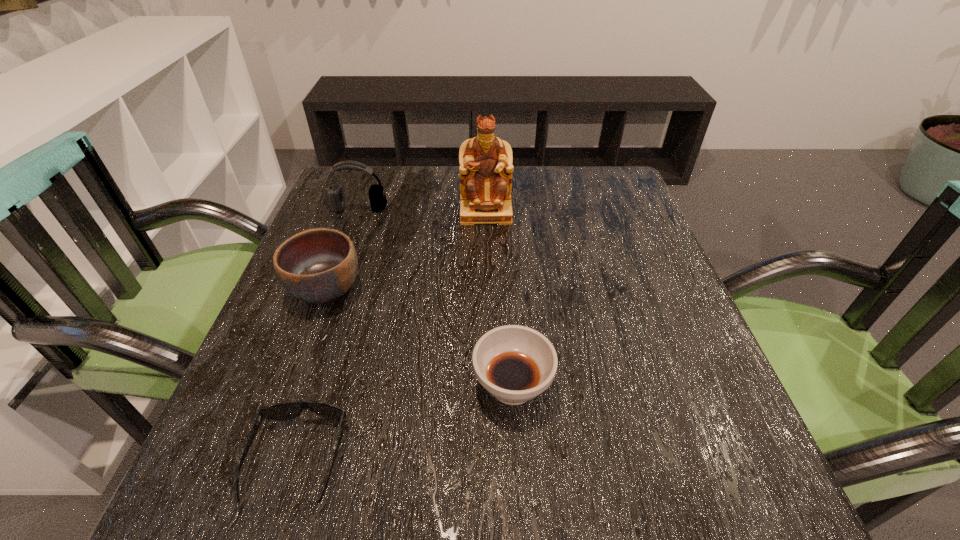
At what (x,y) coordinates should I click in order to perform the action: click on figurine at the far edge. Please return your answer as a coordinate pair (x, y). This screenshot has height=540, width=960. Looking at the image, I should click on (485, 161).

Locate an element on the screen. headset located in the far edge section of the desktop is located at coordinates pos(335,200).

Find the location of a particular element. object that is at the near edge is located at coordinates (281, 411).

You are a GUI agent. You are given a task and a screenshot of the screen. Output one action in this format:
    pyautogui.click(x=<x>, y=<y>)
    Task: Click on the headset that is at the left edge
    
    Given the screenshot: What is the action you would take?
    pyautogui.click(x=335, y=200)

At what (x,y) coordinates should I click in order to perform the action: click on bowl that is at the left edge. Please return your answer as a coordinate pair (x, y). This screenshot has height=540, width=960. Looking at the image, I should click on (317, 266).

You are a GUI agent. You are given a task and a screenshot of the screen. Output one action in this format:
    pyautogui.click(x=<x>, y=<y>)
    Task: Click on the sunglasses located at the left edge
    Image resolution: width=960 pixels, height=540 pixels.
    Given the screenshot: What is the action you would take?
    pyautogui.click(x=281, y=411)

At what (x,y) coordinates should I click in order to perform the action: click on object present at the far left corner. Please return your answer as a coordinate pair (x, y). Looking at the image, I should click on (335, 200).

Locate an element on the screen. object present at the near left corner is located at coordinates click(x=281, y=411).

This screenshot has height=540, width=960. What are the coordinates of `free space at the far edge` in the screenshot? It's located at (539, 215).

In the image, there is a desktop. Where is `free region at the near edge`? The height and width of the screenshot is (540, 960). free region at the near edge is located at coordinates (495, 524).